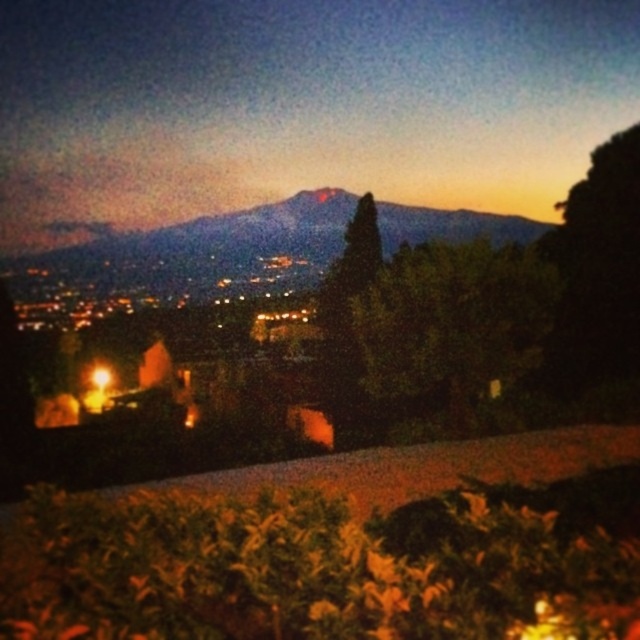
Can you confirm if matte black mountain at upper center is thinner than blue-gray mountain at center?

Incorrect, matte black mountain at upper center's width is not less than blue-gray mountain at center's.

Measure the distance between matte black mountain at upper center and blue-gray mountain at center.

The distance of matte black mountain at upper center from blue-gray mountain at center is 9.80 meters.

In order to click on matte black mountain at upper center in this screenshot , I will do `click(300, 106)`.